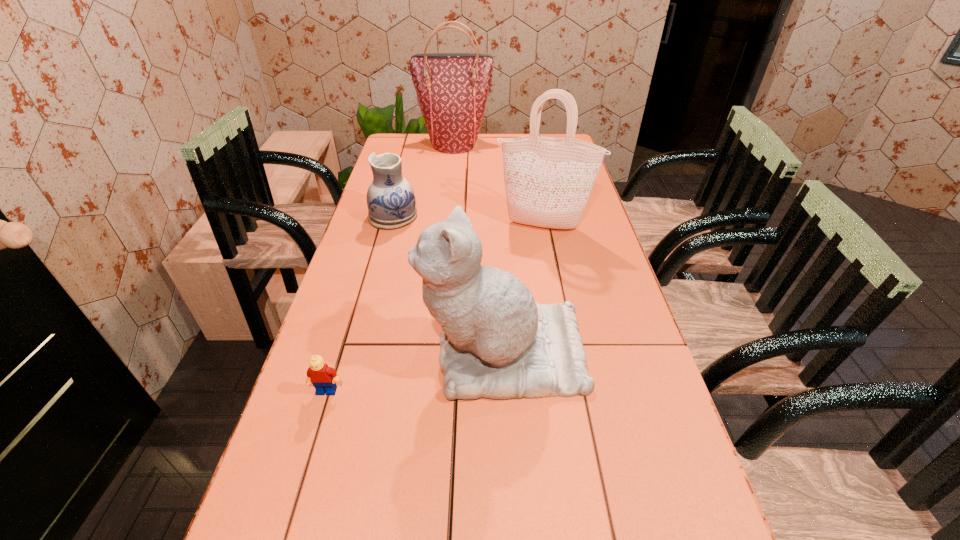
Identify the location of vacant area situated on the front of the fourth tallest object. Image resolution: width=960 pixels, height=540 pixels. (375, 282).

This screenshot has width=960, height=540. Identify the location of free space located on the front-facing side of the Lego. (304, 464).

Locate an element on the screen. object that is at the far edge is located at coordinates (452, 88).

What are the coordinates of `handbag that is positioned at the left edge` in the screenshot? It's located at (452, 88).

Find the location of a particular element. pottery at the left edge is located at coordinates (391, 202).

This screenshot has width=960, height=540. I want to click on Lego that is positioned at the left edge, so click(x=323, y=378).

I want to click on shopping bag situated at the right edge, so click(x=548, y=181).

Identify the location of cat at the right edge. This screenshot has width=960, height=540. (496, 342).

Image resolution: width=960 pixels, height=540 pixels. Identify the location of object that is at the far left corner. pyautogui.click(x=452, y=88).

In the image, there is a desktop. Identify the location of free space at the far edge. This screenshot has width=960, height=540. (495, 154).